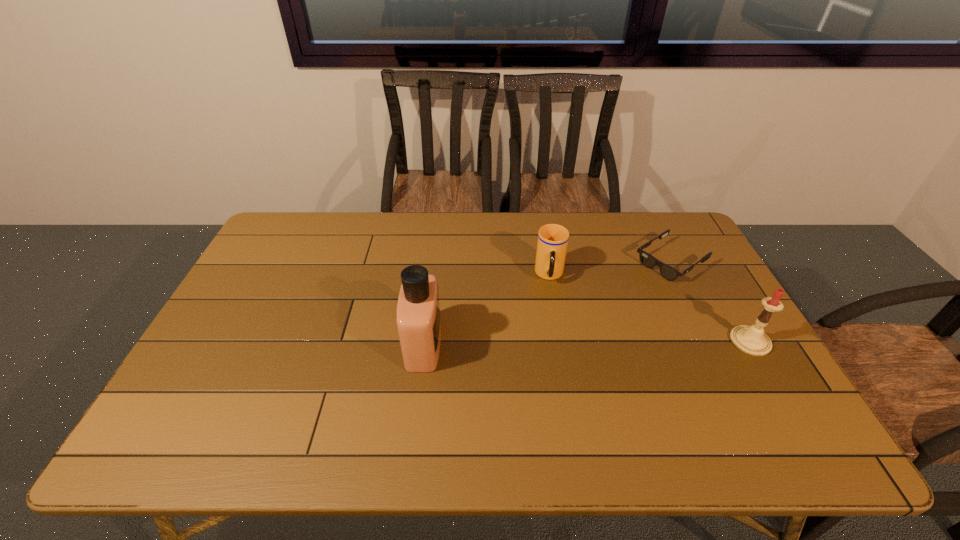
This screenshot has height=540, width=960. Identify the location of perfume. (418, 310).

Identify the location of the leftmost object. (418, 310).

What are the coordinates of `candle` in the screenshot? It's located at (752, 340).

I want to click on the shortest object, so click(x=669, y=273).

I want to click on the second object from left to right, so click(x=552, y=243).

This screenshot has width=960, height=540. I want to click on cup, so click(x=552, y=243).

Locate an element on the screen. Image resolution: width=960 pixels, height=540 pixels. vacant space located 0.260m on the front label of the perfume is located at coordinates (538, 345).

At what (x,y) coordinates should I click in order to perform the action: click on free space located on the back of the third shortest object. Please return your answer as a coordinate pair (x, y). Looking at the image, I should click on (709, 273).

This screenshot has height=540, width=960. I want to click on free location located on the temples of the sunglasses, so click(570, 328).

Locate an element on the screen. This screenshot has height=540, width=960. vacant space located on the temples of the sunglasses is located at coordinates (578, 323).